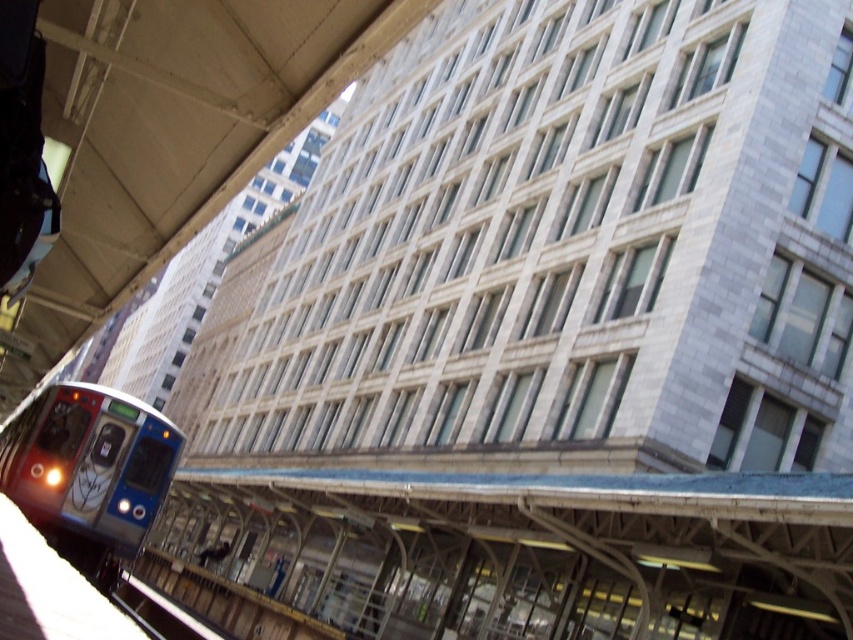
You are a passenger waiting on the platform and see the metallic blue train at lower left and the black metal train track at lower left. Which object is closer to you?

The metallic blue train at lower left is positioned over the black metal train track at lower left, so the train is closer to you than the track.

Consider the image. You are standing at the platform of the train station. You see a point marked at coordinate (90, 464). What object is located at that point?

The point at coordinate (90, 464) marks the metallic blue train at lower left.

You are standing at the center of the train station platform and want to board the metallic blue train at lower left. In which direction should you walk to reach it?

You should walk towards the lower left direction to reach the metallic blue train at lower left since it is located at point (x=90, y=464), which is the lower left position in the image.